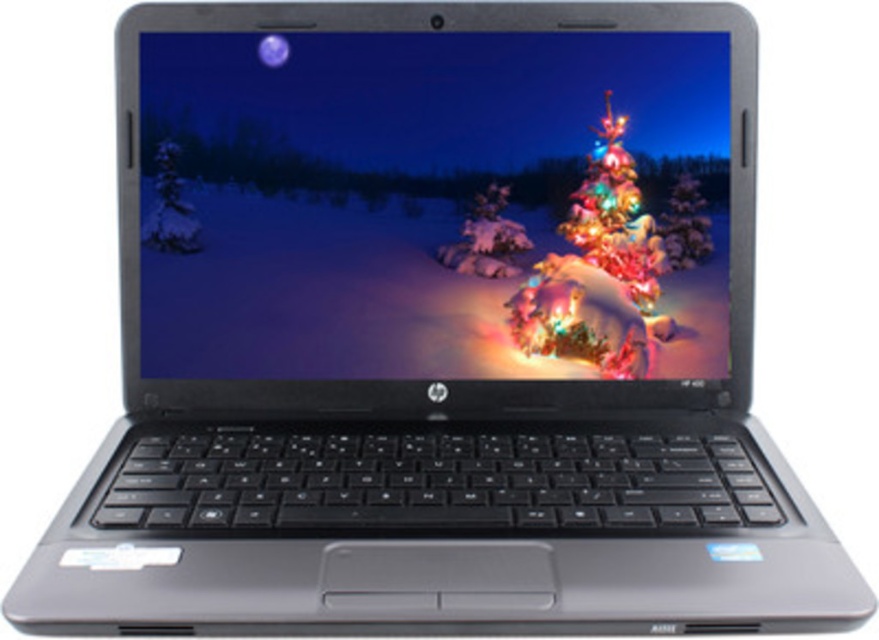
Question: Does matte plastic screen at center have a greater width compared to iridescent plastic christmas tree at center?

Choices:
 (A) no
 (B) yes

Answer: (B)

Question: Among these objects, which one is farthest from the camera?

Choices:
 (A) iridescent plastic christmas tree at center
 (B) matte plastic screen at center

Answer: (A)

Question: Which point is farther to the camera?

Choices:
 (A) iridescent plastic christmas tree at center
 (B) matte plastic screen at center

Answer: (A)

Question: Does matte plastic screen at center appear under iridescent plastic christmas tree at center?

Choices:
 (A) no
 (B) yes

Answer: (A)

Question: Does matte plastic screen at center appear on the left side of iridescent plastic christmas tree at center?

Choices:
 (A) yes
 (B) no

Answer: (A)